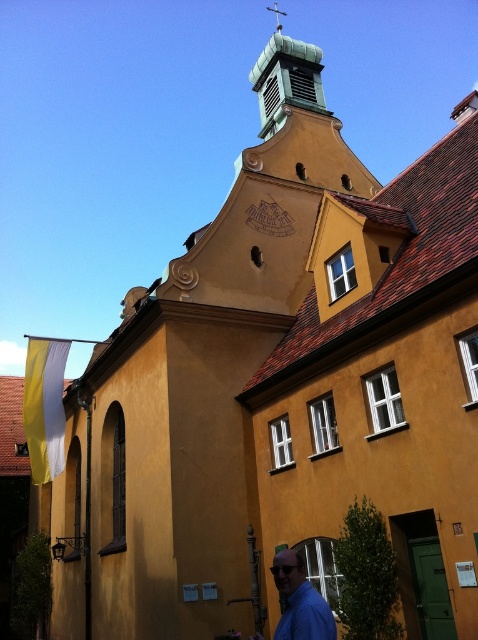
Does green copper spire at upper center lie behind blue matte shirt at lower right?

Yes, green copper spire at upper center is behind blue matte shirt at lower right.

Can you confirm if green copper spire at upper center is smaller than blue matte shirt at lower right?

Actually, green copper spire at upper center might be larger than blue matte shirt at lower right.

Who is more distant from viewer, (316, 74) or (310, 620)?

Point (316, 74)

The width and height of the screenshot is (478, 640). I want to click on green copper spire at upper center, so click(x=285, y=77).